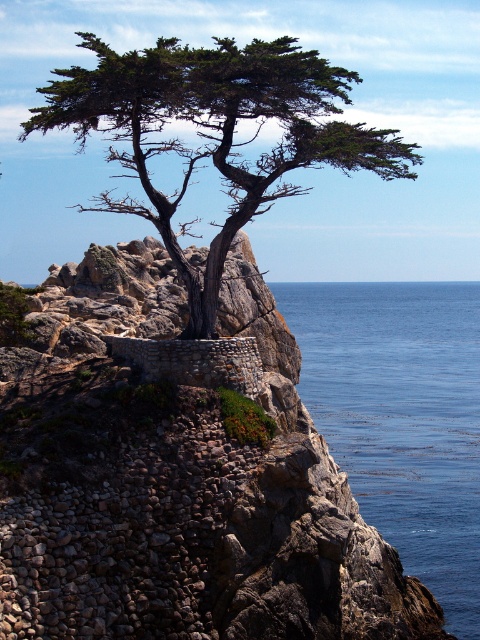
You are standing at the base of the rocky outcrop and want to reach the lone tree. There are two points marked on the path leading to the tree. Which point, point [371,392] or point [292,161], is closer to you?

Point [371,392] is further to the viewer than point [292,161], so point [292,161] is closer to you.

You are a drone operator trying to capture a photo of the lone tree on the rocky outcrop. You need to position your drone so that it is directly above the lone tree and facing the blue liquid water at lower right. What is the direction the drone should face relative to the tree?

The blue liquid water at lower right is located at coordinates (x=400, y=417), so the drone should face towards the lower right direction from the tree to capture the water in the frame.